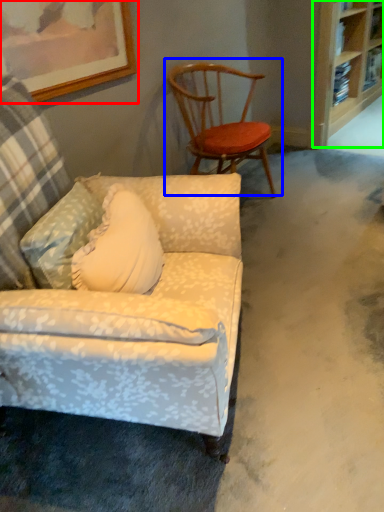
Question: Which object is the farthest from picture frame (highlighted by a red box)? Choose among these: chair (highlighted by a blue box) or shelf (highlighted by a green box).

Choices:
 (A) chair
 (B) shelf

Answer: (B)